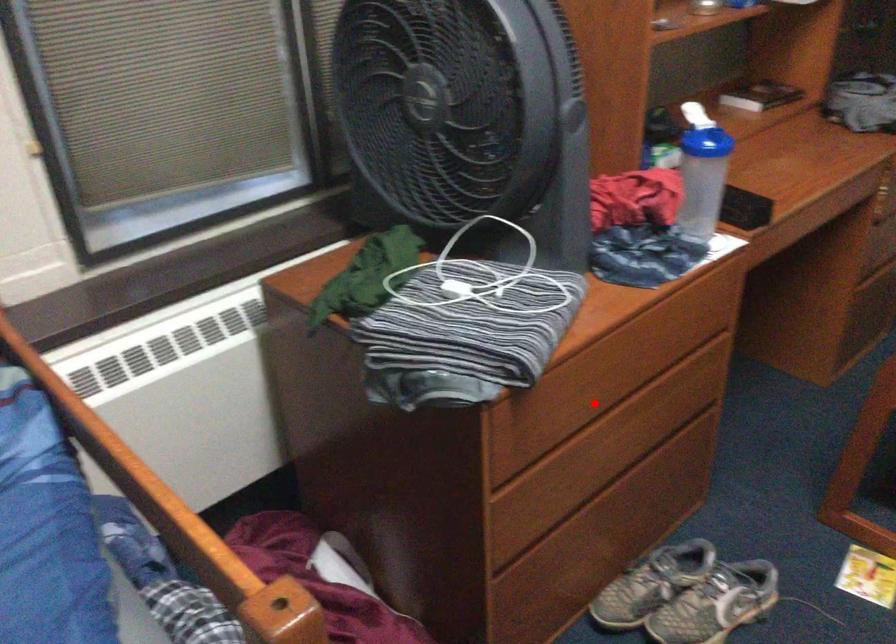
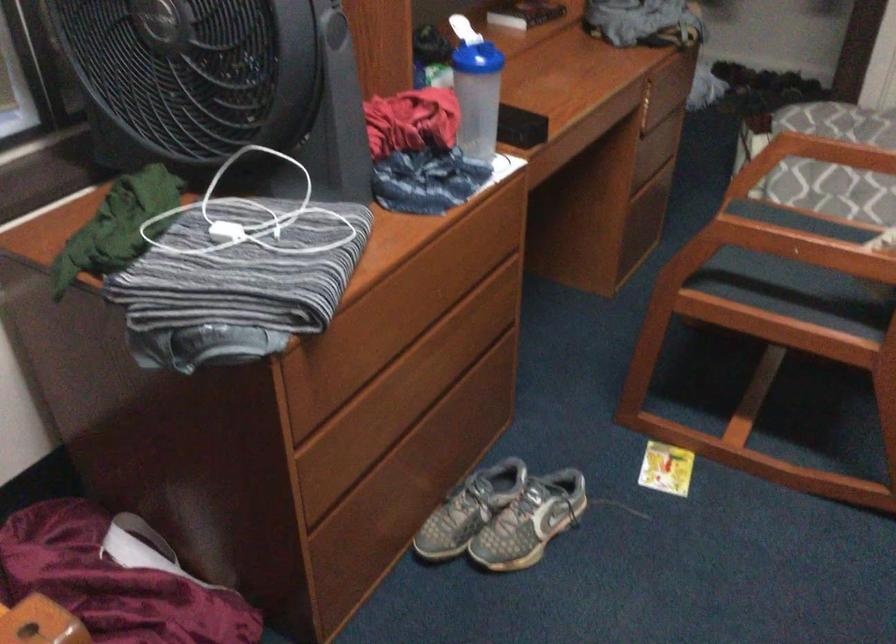
Where in the second image is the point corresponding to the highlighted location from the first image?

(393, 339)